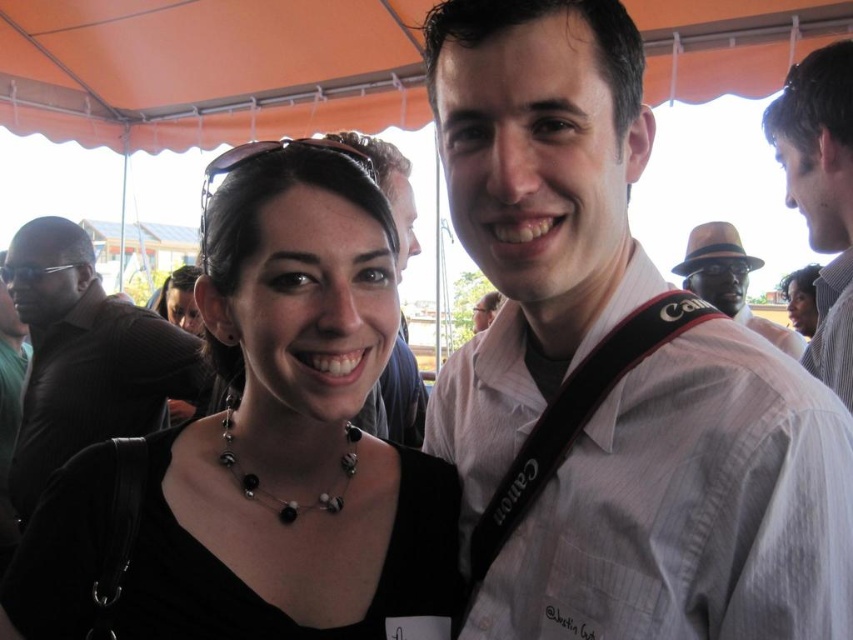
Is black matte necklace at center smaller than black leather shirt at center?

Yes, black matte necklace at center is smaller than black leather shirt at center.

Can you confirm if black matte necklace at center is positioned to the right of black leather shirt at center?

Indeed, black matte necklace at center is positioned on the right side of black leather shirt at center.

Who is more distant from viewer, (28, 556) or (70, 300)?

The point (70, 300) is more distant.

Locate an element on the screen. black matte necklace at center is located at coordinates (265, 448).

Which is below, white striped shirt at center or white striped shirt at upper right?

white striped shirt at center

Is point (699, 355) farther from camera compared to point (840, 280)?

No, it is not.

Is point (486, 84) less distant than point (846, 72)?

Yes, point (486, 84) is closer to viewer.

Locate an element on the screen. Image resolution: width=853 pixels, height=640 pixels. white striped shirt at center is located at coordinates (689, 508).

Can you confirm if white striped shirt at center is wider than black leather shirt at center?

Incorrect, white striped shirt at center's width does not surpass black leather shirt at center's.

Is point (606, 499) farther from camera compared to point (169, 397)?

No.

You are a GUI agent. You are given a task and a screenshot of the screen. Output one action in this format:
    pyautogui.click(x=<x>, y=<y>)
    Task: Click on the white striped shirt at center
    The image size is (853, 640).
    Given the screenshot: What is the action you would take?
    pyautogui.click(x=689, y=508)